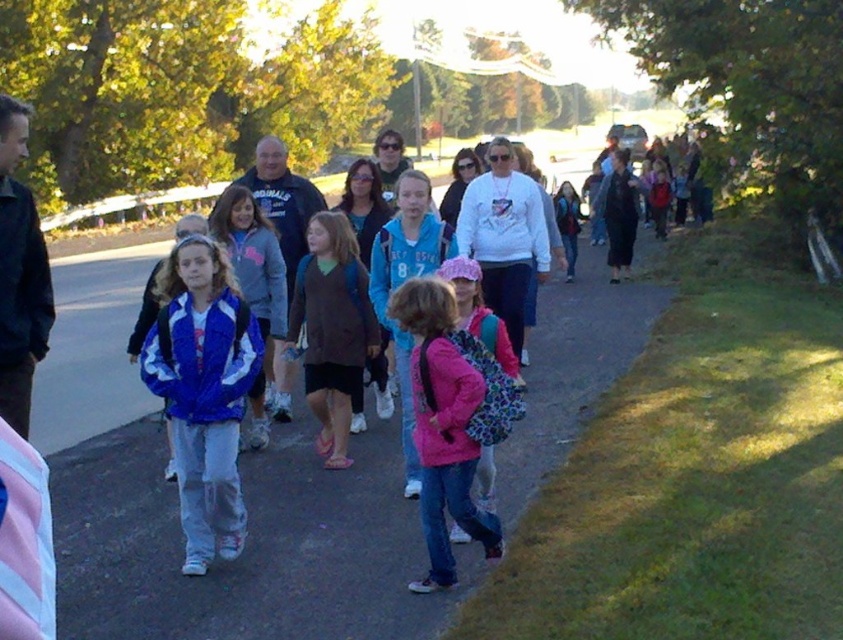
You are a photographer trying to capture a clear shot of the blue fabric backpack at center and the blue synthetic jacket at center. Since you want to focus on both items, which one should you adjust your camera lens to accommodate for its size?

The blue fabric backpack at center has a larger width than the blue synthetic jacket at center, so you should adjust your camera lens to accommodate the blue fabric backpack at center to ensure it fits within the frame.

You are a photographer trying to capture a candid shot of the children in the scene. You notice the blue fabric backpack at center and the brown sweater at center. Which object should you focus on if you want to photograph the child who is closer to the front of the group?

The blue fabric backpack at center is below the brown sweater at center, so focusing on the blue fabric backpack at center would capture the child closer to the front since it is positioned lower in the image.